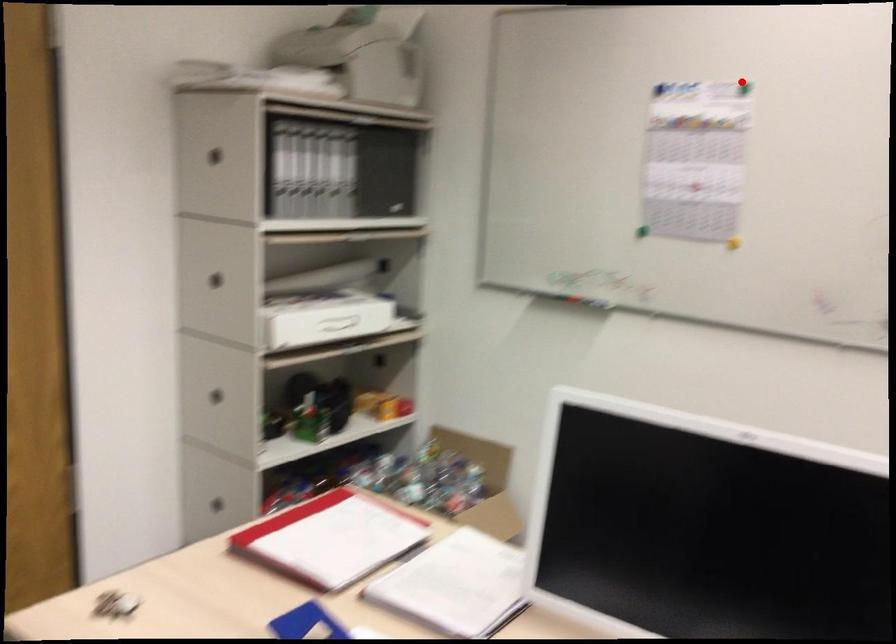
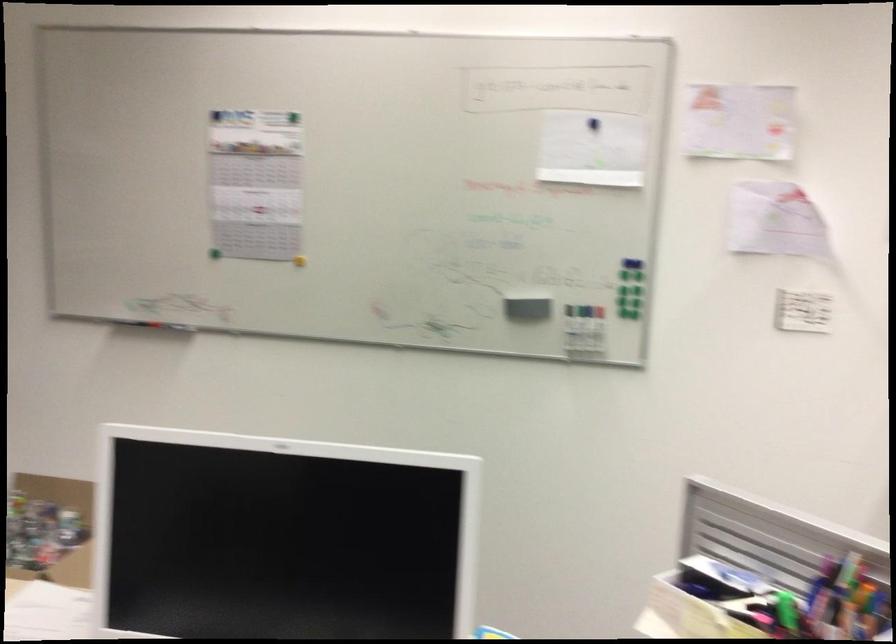
Question: I am providing you with two images of the same scene from different viewpoints. Given a red point in image1, look at the same physical point in image2. Is it:

Choices:
 (A) Closer to the viewpoint
 (B) Farther from the viewpoint

Answer: (B)